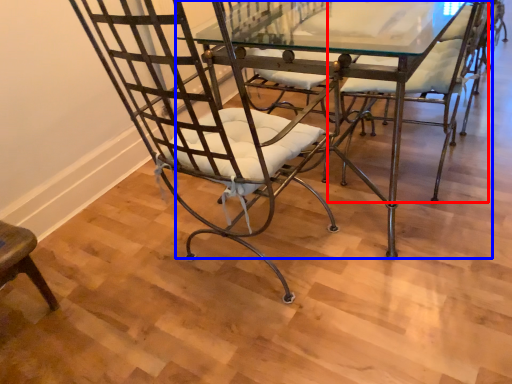
Question: Which object is closer to the camera taking this photo, chair (highlighted by a red box) or table (highlighted by a blue box)?

Choices:
 (A) chair
 (B) table

Answer: (B)